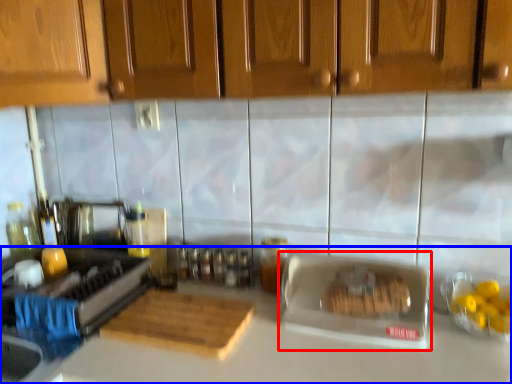
Question: Which object appears closest to the camera in this image, appliance (highlighted by a red box) or countertop (highlighted by a blue box)?

Choices:
 (A) appliance
 (B) countertop

Answer: (B)